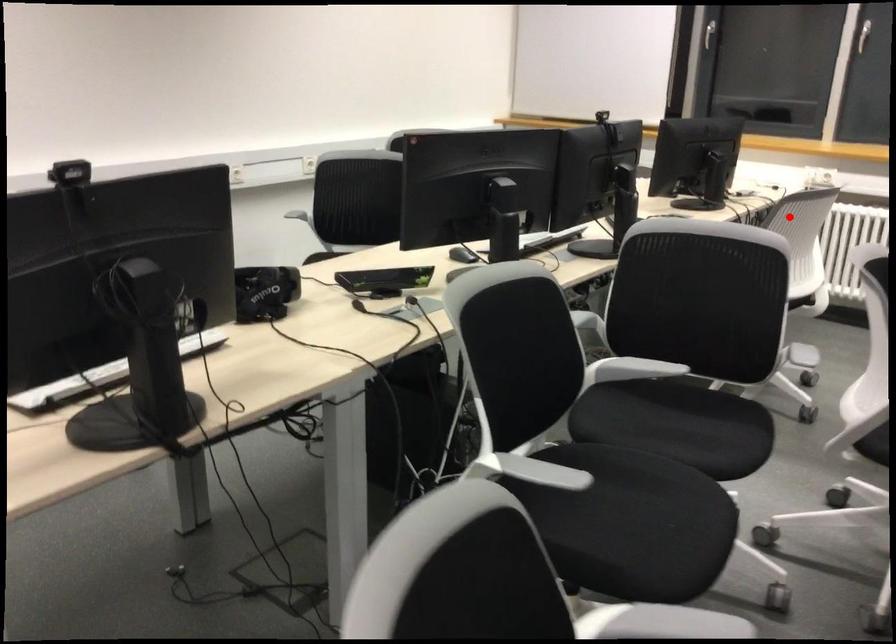
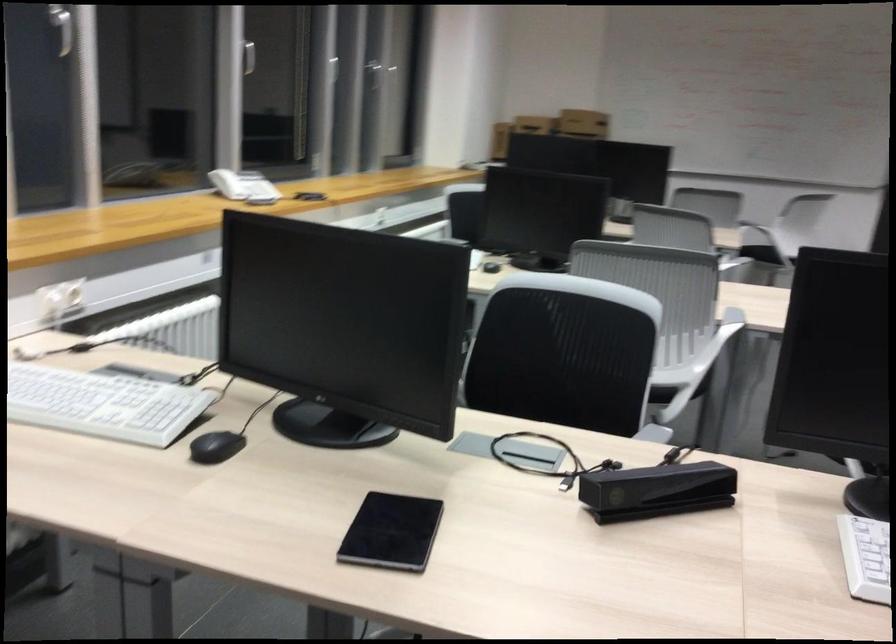
In the second image, find the point that corresponds to the highlighted location in the first image.

(564, 353)